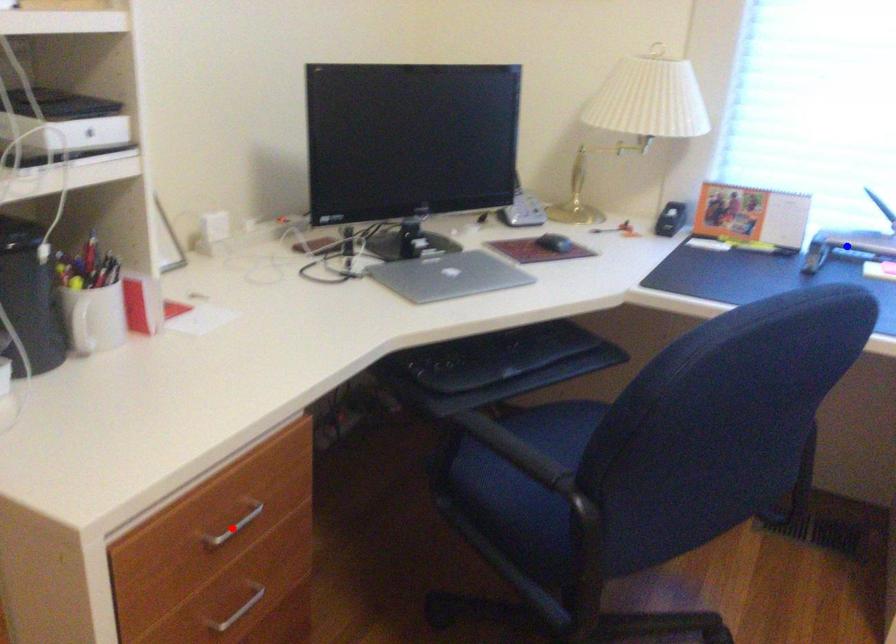
Question: Which of the two points in the image is closer to the camera?

Choices:
 (A) Blue point is closer.
 (B) Red point is closer.

Answer: (B)